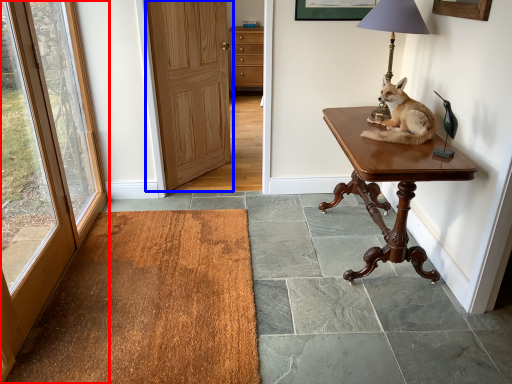
Question: Which of the following is the closest to the observer, door (highlighted by a red box) or door (highlighted by a blue box)?

Choices:
 (A) door
 (B) door

Answer: (A)